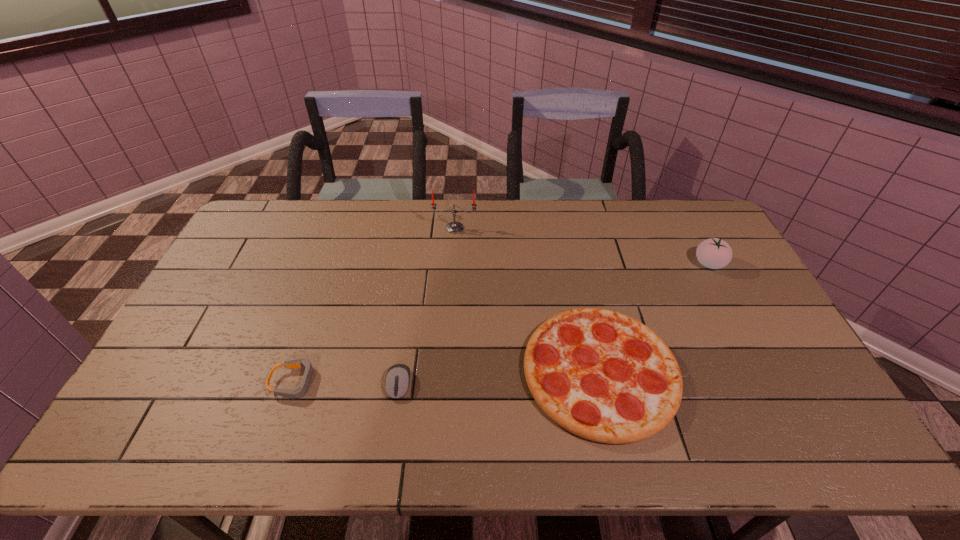
Locate an element on the screen. the third object from left to right is located at coordinates (454, 227).

At what (x,y) coordinates should I click in order to perform the action: click on candle. Please return your answer as a coordinate pair (x, y). This screenshot has width=960, height=540. Looking at the image, I should click on (454, 227).

Where is `the rightmost object`? The width and height of the screenshot is (960, 540). the rightmost object is located at coordinates (714, 253).

Locate an element on the screen. tomato is located at coordinates (714, 253).

This screenshot has width=960, height=540. Identify the location of the fourth object from right to left. (397, 380).

Identify the location of goggles. The width and height of the screenshot is (960, 540). (299, 391).

This screenshot has height=540, width=960. Find the location of `the fourth object from left to right`. the fourth object from left to right is located at coordinates (604, 376).

The width and height of the screenshot is (960, 540). What are the coordinates of `vacant space located 0.130m on the front-facing side of the tallest object` in the screenshot? It's located at (453, 258).

You are a GUI agent. You are given a task and a screenshot of the screen. Output one action in this format:
    pyautogui.click(x=<x>, y=<y>)
    Task: Click on the vacant region located on the left of the second tallest object
    This screenshot has width=960, height=540.
    Given the screenshot: What is the action you would take?
    pyautogui.click(x=666, y=264)

Find the location of a particular element. Image resolution: width=960 pixels, height=540 pixels. vacant space located on the wheel side of the fourth object from right to left is located at coordinates (392, 436).